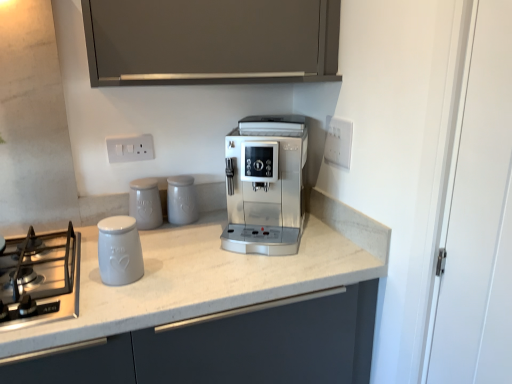
Question: In the image, is white plastic electric outlet at upper center, which ranks as the 2th electric outlet in right-to-left order, positioned in front of or behind stainless steel gas stove at lower left?

Choices:
 (A) behind
 (B) front

Answer: (A)

Question: Would you say white plastic electric outlet at upper center, which ranks as the 2th electric outlet in right-to-left order, is to the left or to the right of stainless steel gas stove at lower left in the picture?

Choices:
 (A) right
 (B) left

Answer: (A)

Question: Which object is positioned closest to the satin silver coffee maker at center?

Choices:
 (A) matte ceramic jar at center, which is the second kitchen appliance from back to front
 (B) white ceramic jar at center, the third kitchen appliance in the back-to-front sequence
 (C) matte ceramic canister at center, marked as the third kitchen appliance in a front-to-back arrangement
 (D) white plastic electric outlet at upper center, positioned as the first electric outlet in left-to-right order
 (E) white plastic electrical outlet at upper right, positioned as the second electric outlet in left-to-right order

Answer: (E)

Question: Which is farther from the white ceramic jar at center, the third kitchen appliance in the back-to-front sequence?

Choices:
 (A) matte ceramic jar at center, the 2th kitchen appliance in the front-to-back sequence
 (B) white plastic electric outlet at upper center, which ranks as the 2th electric outlet in right-to-left order
 (C) white plastic electrical outlet at upper right, positioned as the second electric outlet in left-to-right order
 (D) satin silver coffee maker at center
 (E) matte ceramic canister at center, placed as the 1th kitchen appliance when sorted from back to front

Answer: (C)